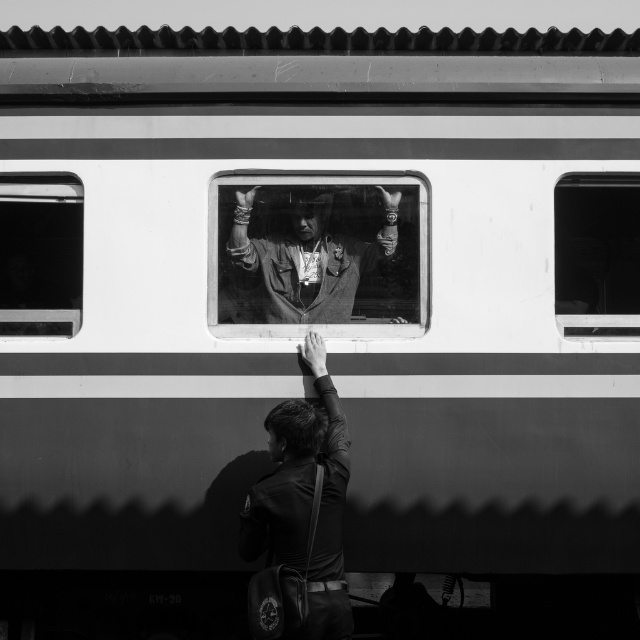
Question: Is the position of leather jacket at center less distant than that of transparent glass window at upper left?

Choices:
 (A) yes
 (B) no

Answer: (A)

Question: Does leather jacket at center have a lesser width compared to transparent glass window at upper left?

Choices:
 (A) no
 (B) yes

Answer: (A)

Question: Among these objects, which one is nearest to the camera?

Choices:
 (A) transparent glass window at upper left
 (B) leather jacket at center
 (C) matte leather jacket at center
 (D) transparent glass window at right

Answer: (B)

Question: Does transparent glass window at right appear under transparent glass window at upper left?

Choices:
 (A) yes
 (B) no

Answer: (B)

Question: Among these points, which one is nearest to the camera?

Choices:
 (A) (627, 332)
 (B) (298, 435)
 (C) (300, 314)
 (D) (61, 296)

Answer: (B)

Question: Among these points, which one is nearest to the camera?

Choices:
 (A) (605, 324)
 (B) (24, 332)
 (C) (323, 285)

Answer: (A)